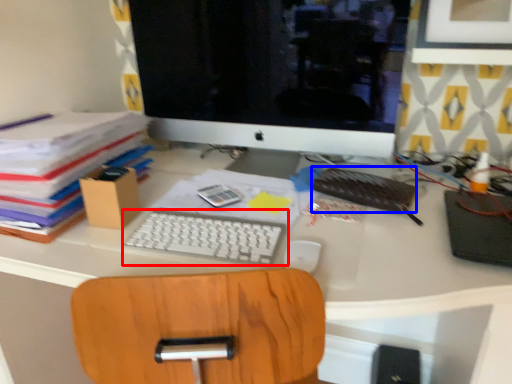
Question: Which object appears farthest to the camera in this image, computer keyboard (highlighted by a red box) or notebook (highlighted by a blue box)?

Choices:
 (A) computer keyboard
 (B) notebook

Answer: (B)